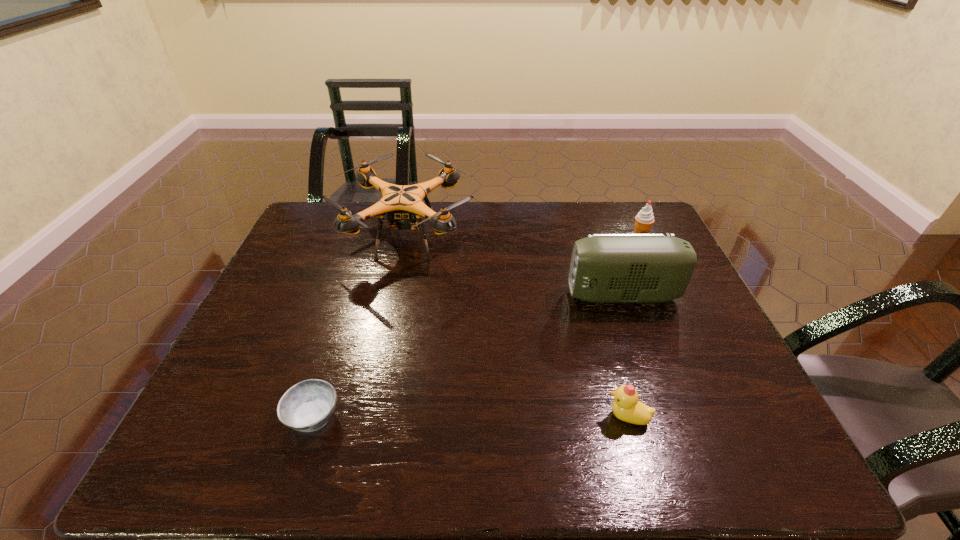
The height and width of the screenshot is (540, 960). I want to click on drone, so click(x=402, y=204).

The image size is (960, 540). What are the coordinates of `radio_receiver` in the screenshot? It's located at (605, 268).

Image resolution: width=960 pixels, height=540 pixels. I want to click on icecream, so click(x=643, y=221).

Where is `the second shortest object`? The image size is (960, 540). the second shortest object is located at coordinates (626, 407).

Where is `the shortest object`? This screenshot has height=540, width=960. the shortest object is located at coordinates (307, 406).

The image size is (960, 540). Identify the location of vacant space located 0.330m on the camera mount of the drone. (577, 238).

You are a GUI agent. You are given a task and a screenshot of the screen. Output one action in this format:
    pyautogui.click(x=<x>, y=<y>)
    Task: Click on the blank space located 0.070m on the front-facing side of the radio_receiver
    
    Given the screenshot: What is the action you would take?
    pyautogui.click(x=543, y=295)

Find the location of `free space located on the front-facing side of the radio_receiver`. free space located on the front-facing side of the radio_receiver is located at coordinates (467, 295).

This screenshot has width=960, height=540. What are the coordinates of `free region located 0.220m on the front-facing side of the radio_receiver` in the screenshot? It's located at (489, 295).

The height and width of the screenshot is (540, 960). What are the coordinates of `free location located on the left of the third shortest object` in the screenshot? It's located at (556, 237).